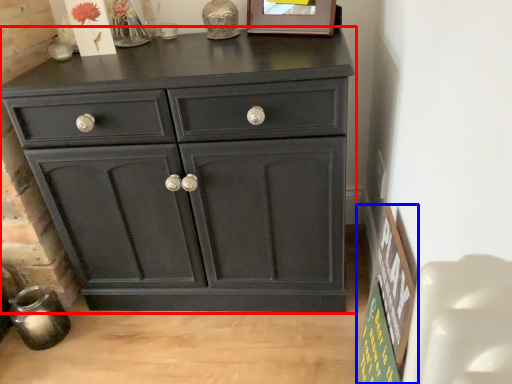
Question: Which object appears closest to the camera in this image, chest of drawers (highlighted by a red box) or bulletin board (highlighted by a blue box)?

Choices:
 (A) chest of drawers
 (B) bulletin board

Answer: (B)